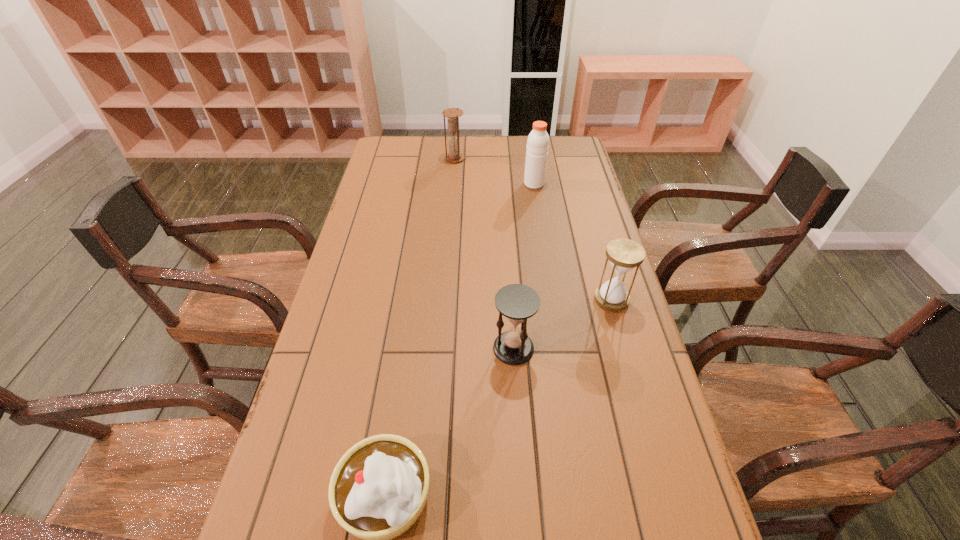
I want to click on free point between the rightmost hourglass and the leftmost hourglass, so click(x=533, y=229).

At what (x,y) coordinates should I click in order to perform the action: click on free point between the rightmost hourglass and the shaker. Please return your answer as a coordinate pair (x, y). Looking at the image, I should click on [x=573, y=241].

Identify the location of free space between the second nearest hourglass and the shaker. The height and width of the screenshot is (540, 960). (573, 241).

Image resolution: width=960 pixels, height=540 pixels. Find the location of `free point between the tallest object and the farthest hourglass`. free point between the tallest object and the farthest hourglass is located at coordinates (494, 171).

Where is `free space that is in between the leftmost hourglass and the third farthest object`? free space that is in between the leftmost hourglass and the third farthest object is located at coordinates (533, 229).

Locate an element on the screen. This screenshot has width=960, height=540. the closest object relative to the second object from right to left is located at coordinates (454, 156).

Identify which object is located as the second nearest to the farthest object. Please provide its 2D coordinates. Your answer should be formatted as a tuple, i.e. [(x, y)], where the tuple contains the x and y coordinates of a point satisfying the conditions above.

[(624, 254)]

This screenshot has width=960, height=540. What are the coordinates of `hourglass object that ranks as the third closest to the shortest object` in the screenshot? It's located at (454, 156).

Point out which hourglass is positioned as the nearest to the rightmost object. Please provide its 2D coordinates. Your answer should be formatted as a tuple, i.e. [(x, y)], where the tuple contains the x and y coordinates of a point satisfying the conditions above.

[(517, 302)]